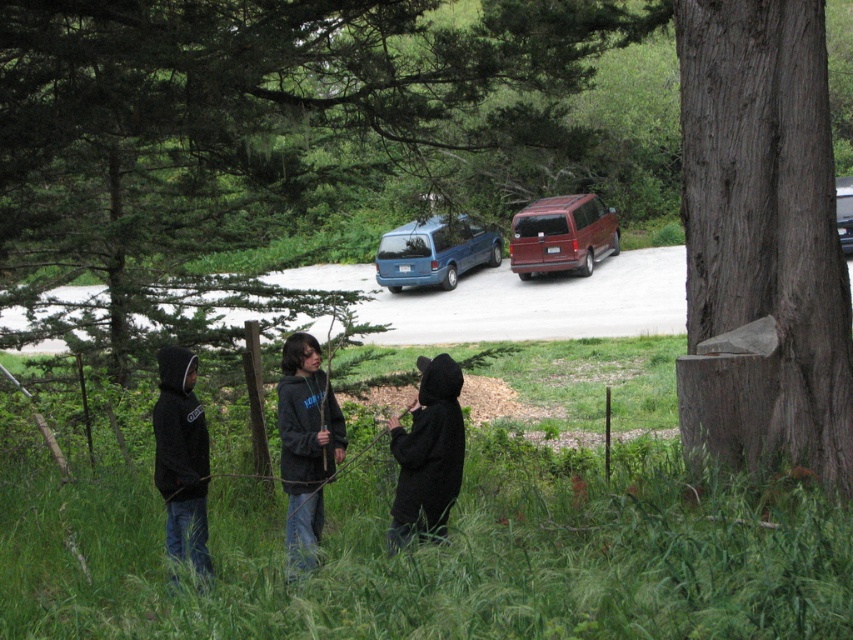
Where is `black hoodie at left`? black hoodie at left is located at coordinates (181, 458).

Which of these two, black hoodie at left or blue metallic van at center, stands taller?

blue metallic van at center is taller.

Which is in front, point (184, 532) or point (451, 244)?

Positioned in front is point (184, 532).

You are a GUI agent. You are given a task and a screenshot of the screen. Output one action in this format:
    pyautogui.click(x=<x>, y=<y>)
    Task: Click on the black hoodie at left
    Image resolution: width=853 pixels, height=640 pixels.
    Given the screenshot: What is the action you would take?
    pyautogui.click(x=181, y=458)

Can you confirm if green grass at lower center is smaller than black fuzzy jacket at center?

Incorrect, green grass at lower center is not smaller in size than black fuzzy jacket at center.

Who is more forward, (682,612) or (412,524)?

Point (682,612) is more forward.

Locate an element on the screen. green grass at lower center is located at coordinates (430, 548).

Does gray rough bark tree trunk at right have a greater height compared to brown rough wooden post at center?

Yes.

Between gray rough bark tree trunk at right and brown rough wooden post at center, which one is positioned higher?

gray rough bark tree trunk at right

Which is in front, point (689, 312) or point (252, 426)?

Point (689, 312) is more forward.

In order to click on gray rough bark tree trunk at right in this screenshot , I will do `click(761, 240)`.